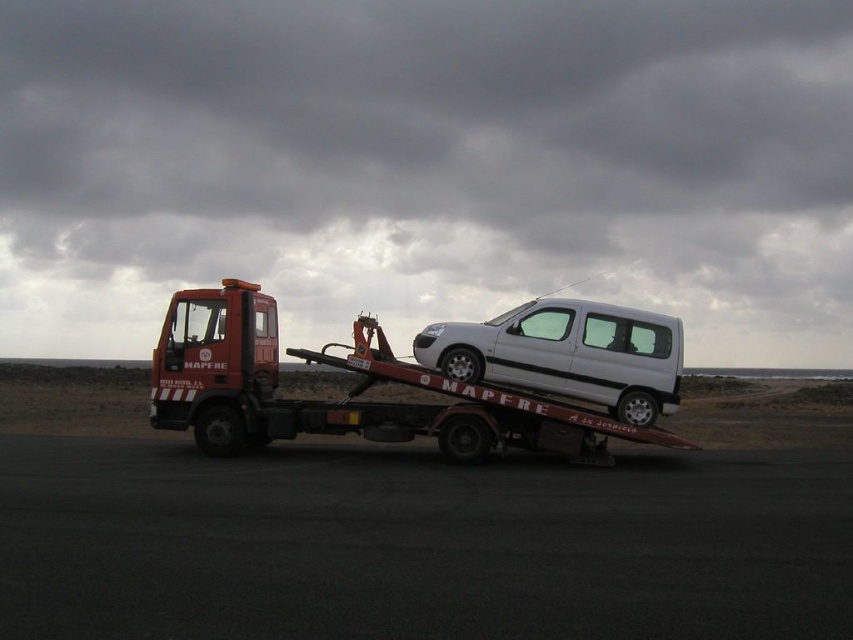
You are standing at the point labeled as point [346,394]. What object are you directly facing?

You are directly facing the matte red tow truck at center, as indicated by the point [346,394].

Consider the image. You are a delivery driver who needs to pass under a low bridge that has a height limit of 2 meters. You see the matte red tow truck at center and the white matte van at center in the image. Which vehicle should you avoid to ensure you can pass safely under the bridge?

The matte red tow truck at center is much taller than the white matte van at center, so you should avoid the matte red tow truck at center to ensure you can pass safely under the bridge.

You are a delivery driver who needs to park your vehicle next to the tow truck and van. The parking space is only wide enough for a vehicle of the same width as the white matte van at center. Can you safely park your vehicle next to the matte red tow truck at center without overlapping?

The matte red tow truck at center is wider than the white matte van at center. Since the parking space is only wide enough for the van, the tow truck cannot fit. Therefore, you cannot safely park your vehicle next to the matte red tow truck at center without overlapping.